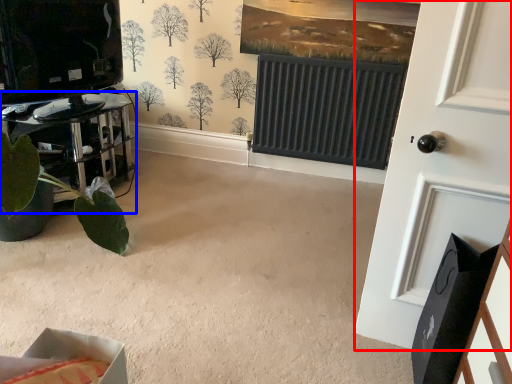
Question: Which point is closer to the camera, door (highlighted by a red box) or furniture (highlighted by a blue box)?

Choices:
 (A) door
 (B) furniture

Answer: (A)